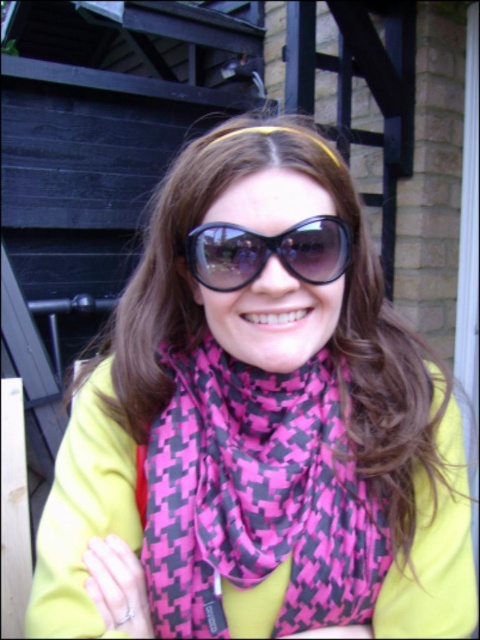
Describe the element at coordinates (255, 497) in the screenshot. I see `pink/black houndstooth scarf at center` at that location.

Can you confirm if pink/black houndstooth scarf at center is wider than black glossy sunglasses at center?

Correct, the width of pink/black houndstooth scarf at center exceeds that of black glossy sunglasses at center.

Does point (182, 436) come behind point (311, 272)?

Yes, point (182, 436) is farther from viewer.

The width and height of the screenshot is (480, 640). I want to click on pink/black houndstooth scarf at center, so click(255, 497).